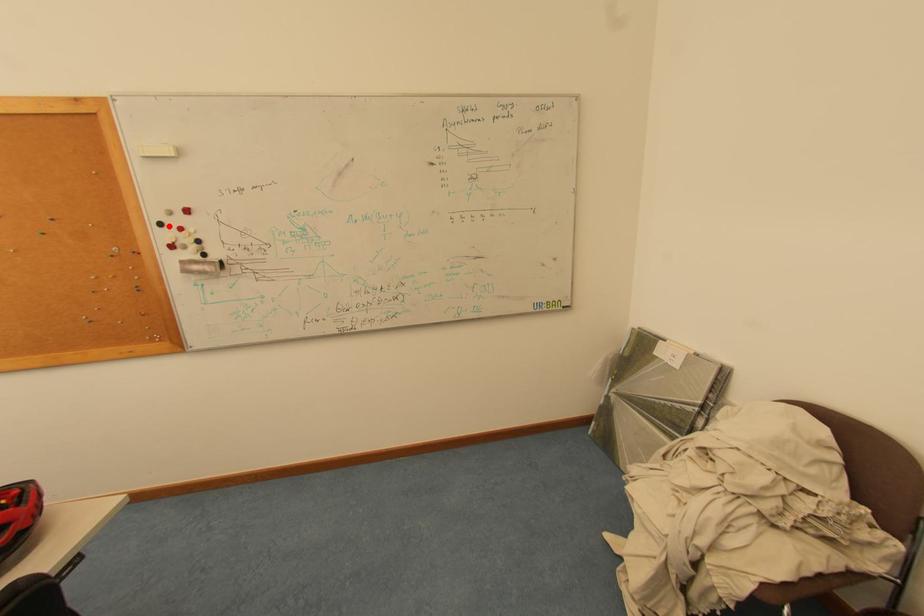
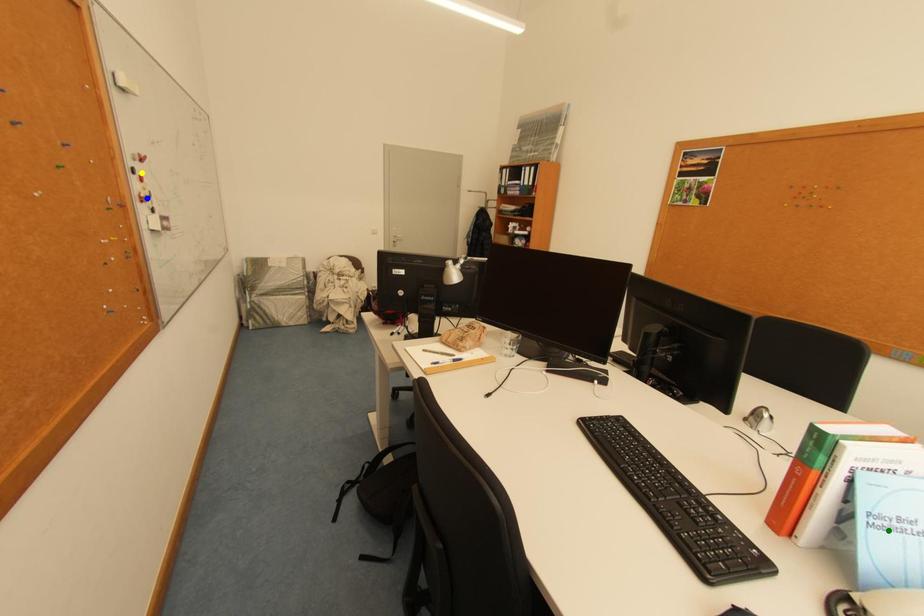
Question: I am providing you with two images of the same scene from different viewpoints. A red point is marked on the first image. You are given multiple points on the second image. Which mark in image 2 goes with the point in image 1?

Choices:
 (A) yellow point
 (B) blue point
 (C) green point

Answer: (A)